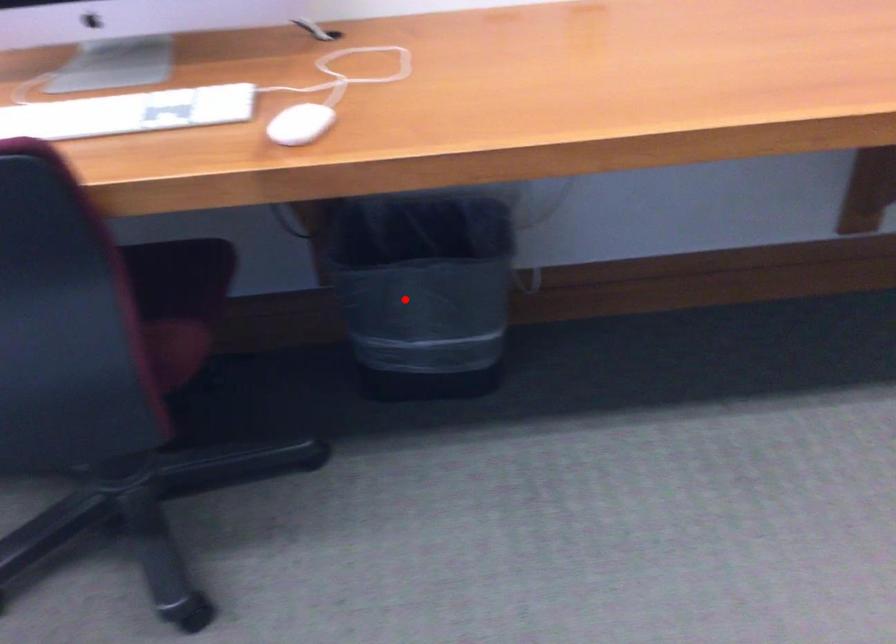
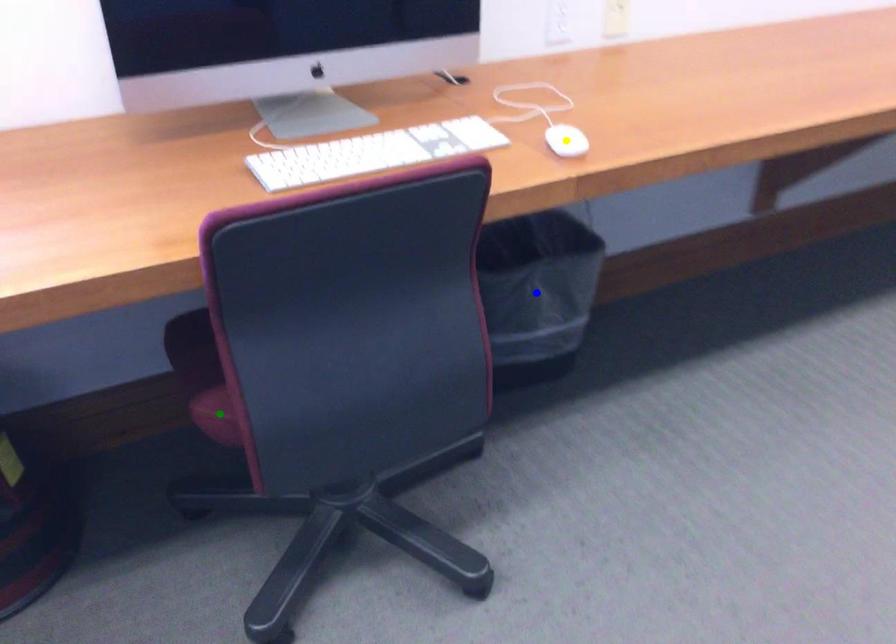
Question: I am providing you with two images of the same scene from different viewpoints. A red point is marked on the first image. You are given multiple points on the second image. Which mark in image 2 goes with the point in image 1?

Choices:
 (A) blue point
 (B) yellow point
 (C) green point

Answer: (A)